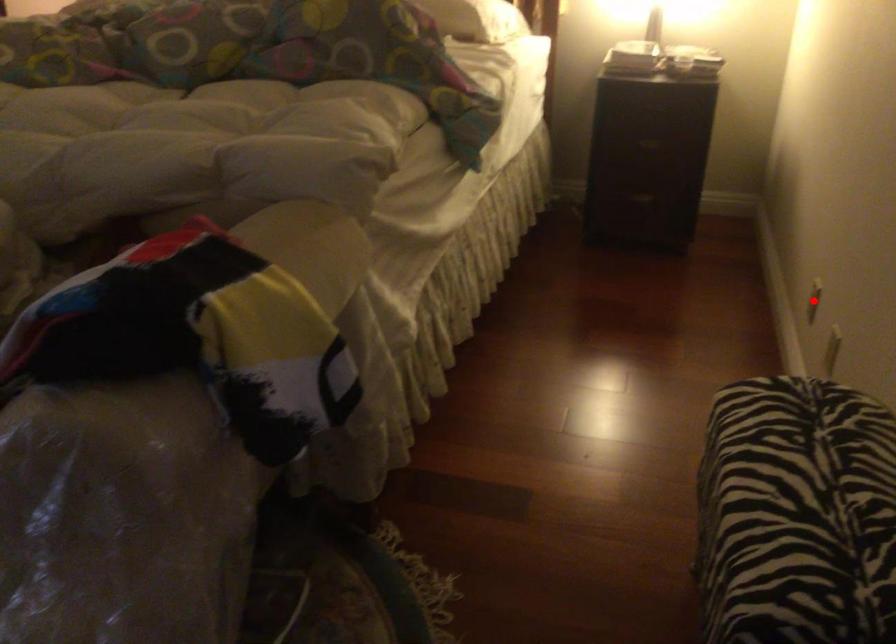
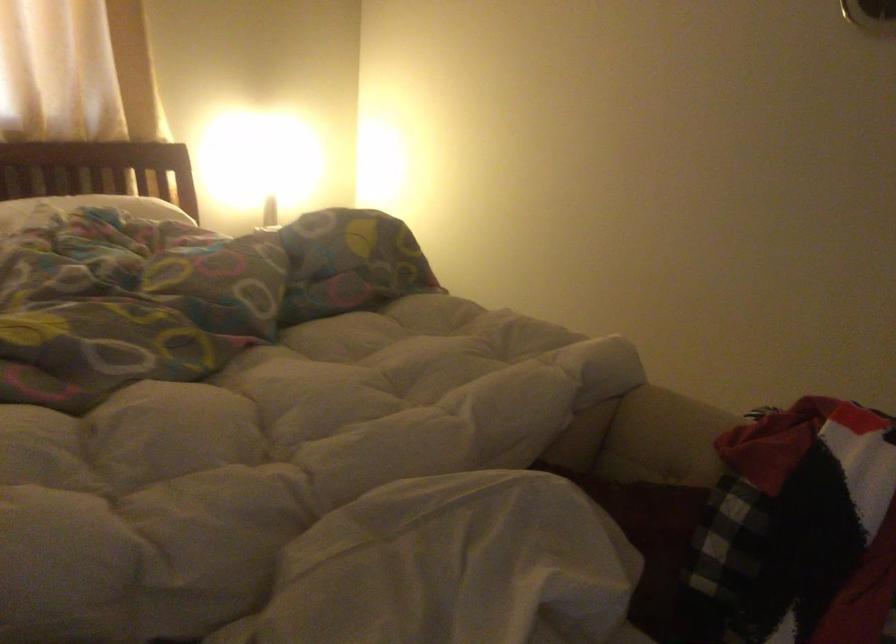
Question: I am providing you with two images of the same scene from different viewpoints. A red point is marked on the first image. Can you still see the location of the red point in image 2?

Choices:
 (A) Yes
 (B) No

Answer: (B)